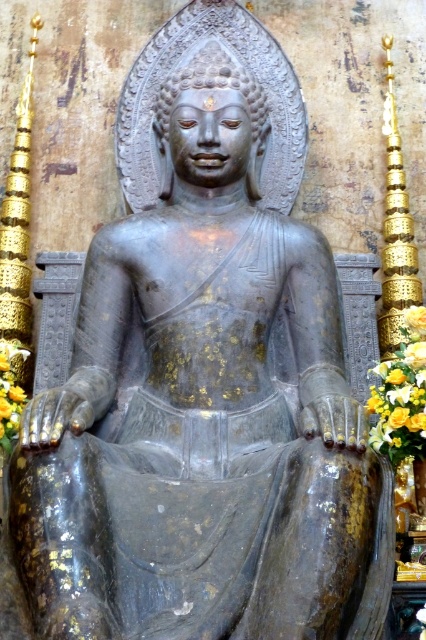
You are a temple visitor who wants to place a new decoration between the yellow silk flower at lower right and the yellow fabric at lower left. Which object should you place closer to the Buddha statue to ensure the decoration is balanced?

The yellow silk flower at lower right is larger than the yellow fabric at lower left, so to balance the decoration, you should place the smaller yellow fabric at lower left closer to the Buddha statue.